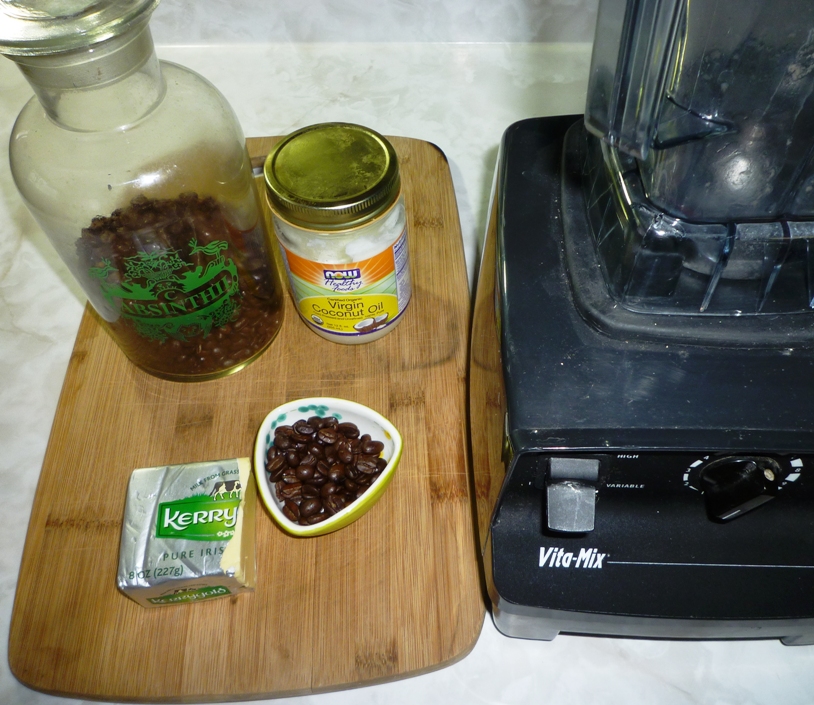
Find the location of a particular element. The height and width of the screenshot is (705, 814). cuttinf board is located at coordinates (304, 646).